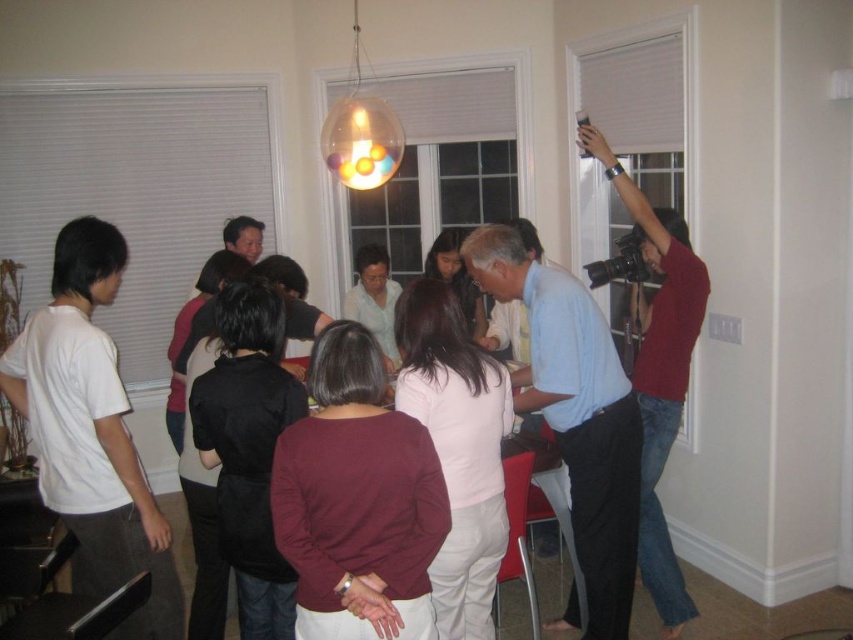
Between burgundy fabric blouse at center and white cotton t-shirt at left, which one has less height?

With less height is burgundy fabric blouse at center.

Does burgundy fabric blouse at center lie behind white cotton t-shirt at left?

No, it is in front of white cotton t-shirt at left.

Consider the image. Who is more distant from viewer, (403, 509) or (102, 410)?

The point (102, 410) is behind.

The width and height of the screenshot is (853, 640). In order to click on burgundy fabric blouse at center in this screenshot , I will do `click(357, 499)`.

At what (x,y) coordinates should I click in order to perform the action: click on white cotton t-shirt at left. Please return your answer as a coordinate pair (x, y). The width and height of the screenshot is (853, 640). Looking at the image, I should click on (91, 433).

Is white cotton t-shirt at left behind red sweater at upper right?

No, white cotton t-shirt at left is in front of red sweater at upper right.

Between point (173, 573) and point (657, 598), which one is positioned in front?

Point (173, 573)

In order to click on white cotton t-shirt at left in this screenshot , I will do `click(91, 433)`.

Who is positioned more to the left, burgundy fabric blouse at center or red sweater at upper right?

burgundy fabric blouse at center is more to the left.

Which is in front, point (340, 412) or point (676, 298)?

Point (340, 412) is in front.

Image resolution: width=853 pixels, height=640 pixels. Identify the location of burgundy fabric blouse at center. (357, 499).